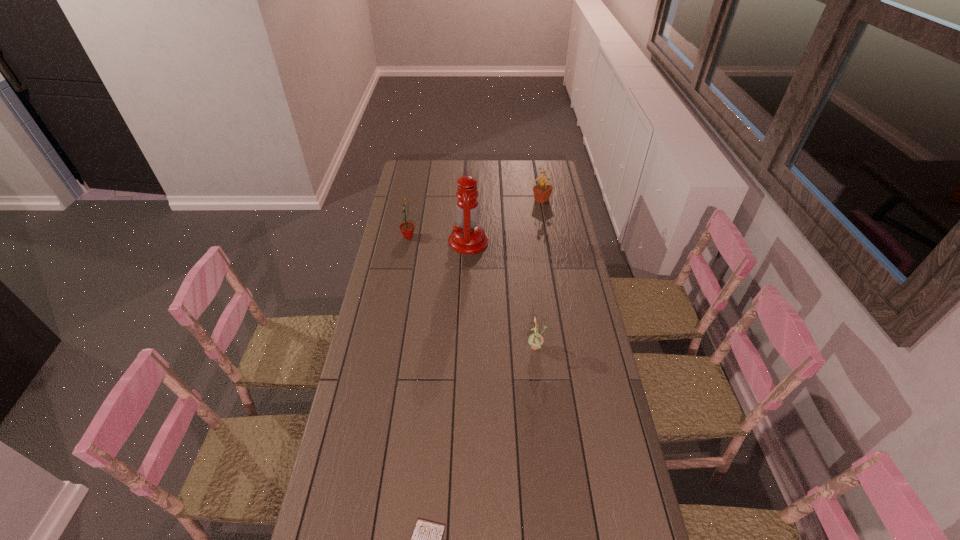
Locate an element on the screen. oil lamp is located at coordinates (467, 237).

Identify the location of the leftmost object. (407, 228).

Locate an element on the screen. This screenshot has height=540, width=960. the leftmost sunflower is located at coordinates click(407, 228).

Where is `the farthest object`? This screenshot has width=960, height=540. the farthest object is located at coordinates (542, 191).

Image resolution: width=960 pixels, height=540 pixels. Find the location of `the rightmost sunflower`. the rightmost sunflower is located at coordinates (542, 191).

Where is `the second object from right to left`? The image size is (960, 540). the second object from right to left is located at coordinates (536, 340).

At what (x,y) coordinates should I click in order to perform the action: click on the fourth tallest object. Please return your answer as a coordinate pair (x, y). Image resolution: width=960 pixels, height=540 pixels. Looking at the image, I should click on (536, 340).

The image size is (960, 540). In order to click on vacant space located on the right of the tallest object in this screenshot , I will do `click(552, 241)`.

The height and width of the screenshot is (540, 960). I want to click on vacant space situated 0.380m on the face of the second farthest sunflower, so click(x=495, y=237).

This screenshot has height=540, width=960. Identify the location of free location located 0.260m at the front of the farthest sunflower with flowers visible. (482, 200).